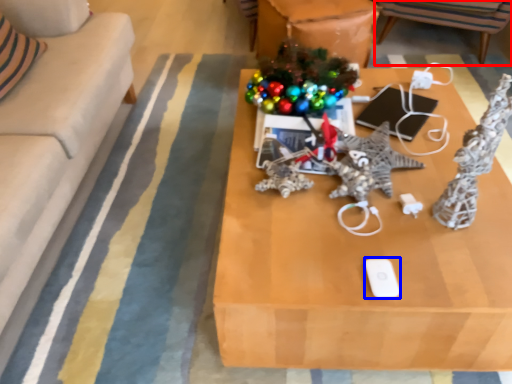
Question: Which point is closer to the camera, chair (highlighted by a red box) or ipod (highlighted by a blue box)?

Choices:
 (A) chair
 (B) ipod

Answer: (B)